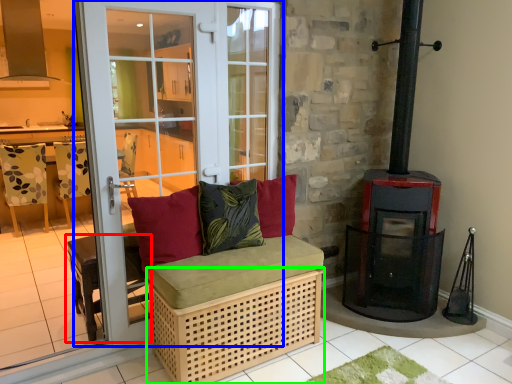
Question: Which object is the closest to the furniture (highlighted by a red box)? Choose among these: door (highlighted by a blue box) or crate (highlighted by a green box).

Choices:
 (A) door
 (B) crate

Answer: (A)